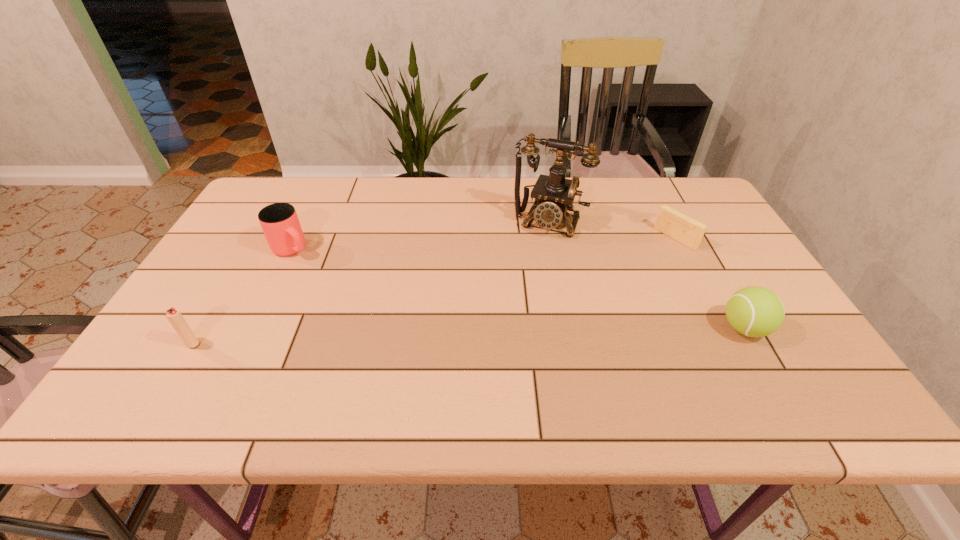
Identify the location of vacant space on the desktop that is between the leftmost object and the tennis ball and is positioned on the handle side of the cup. (404, 338).

The image size is (960, 540). I want to click on free space on the desktop that is between the leftmost object and the tennis ball and is positioned on the rotary dial of the tallest object, so click(x=502, y=335).

The height and width of the screenshot is (540, 960). Find the location of `vacant space on the desktop that is between the igniter and the tennis ball and is positioned at the front of the videotape with spools`. vacant space on the desktop that is between the igniter and the tennis ball and is positioned at the front of the videotape with spools is located at coordinates (532, 334).